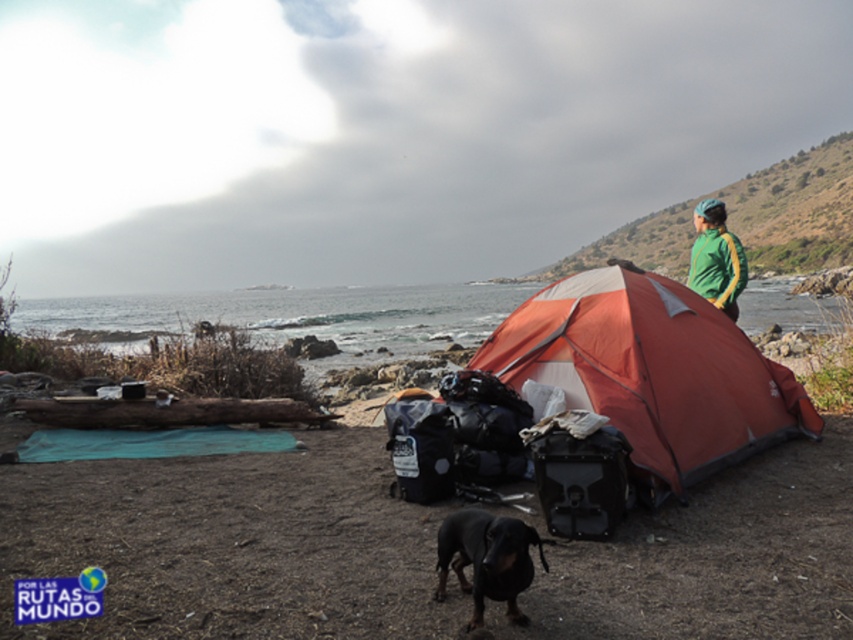
Who is shorter, orange nylon tent at center or green/yellow track jacket at upper right?

green/yellow track jacket at upper right is shorter.

Is orange nylon tent at center positioned at the back of green/yellow track jacket at upper right?

No, it is not.

Is point (656, 481) closer to viewer compared to point (717, 246)?

Yes, point (656, 481) is closer to viewer.

The height and width of the screenshot is (640, 853). Identify the location of orange nylon tent at center. (651, 372).

Which of these two, black smooth dog at lower center or green/yellow track jacket at upper right, stands shorter?

black smooth dog at lower center is shorter.

How far apart are black smooth dog at lower center and green/yellow track jacket at upper right?

black smooth dog at lower center and green/yellow track jacket at upper right are 4.63 meters apart.

Where is `black smooth dog at lower center`? The width and height of the screenshot is (853, 640). black smooth dog at lower center is located at coordinates (486, 560).

Where is `black smooth dog at lower center`? black smooth dog at lower center is located at coordinates (486, 560).

Between orange nylon tent at center and black smooth dog at lower center, which one has more height?

With more height is orange nylon tent at center.

Does orange nylon tent at center have a larger size compared to black smooth dog at lower center?

Yes.

Is point (677, 356) farther from viewer compared to point (482, 540)?

That is True.

Locate an element on the screen. The image size is (853, 640). orange nylon tent at center is located at coordinates (651, 372).